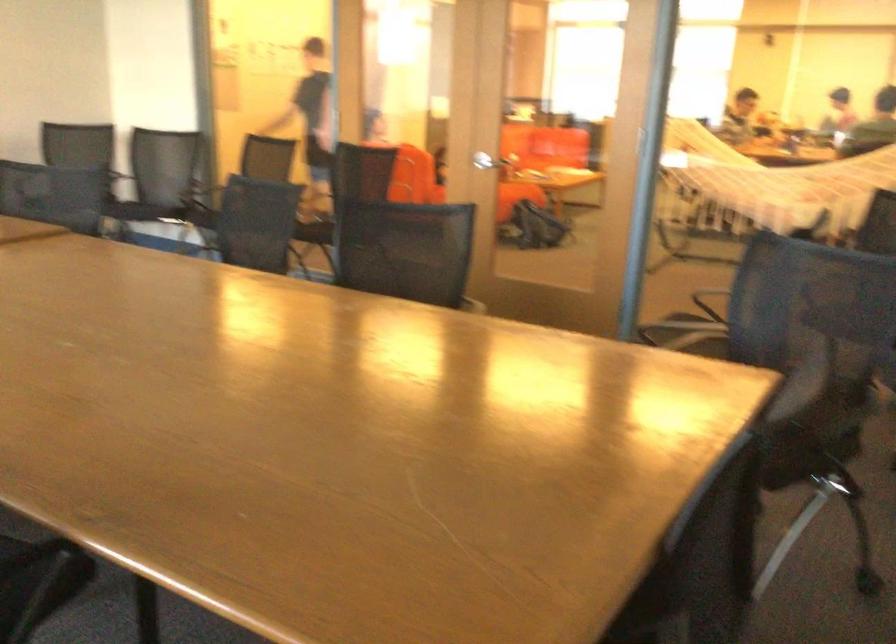
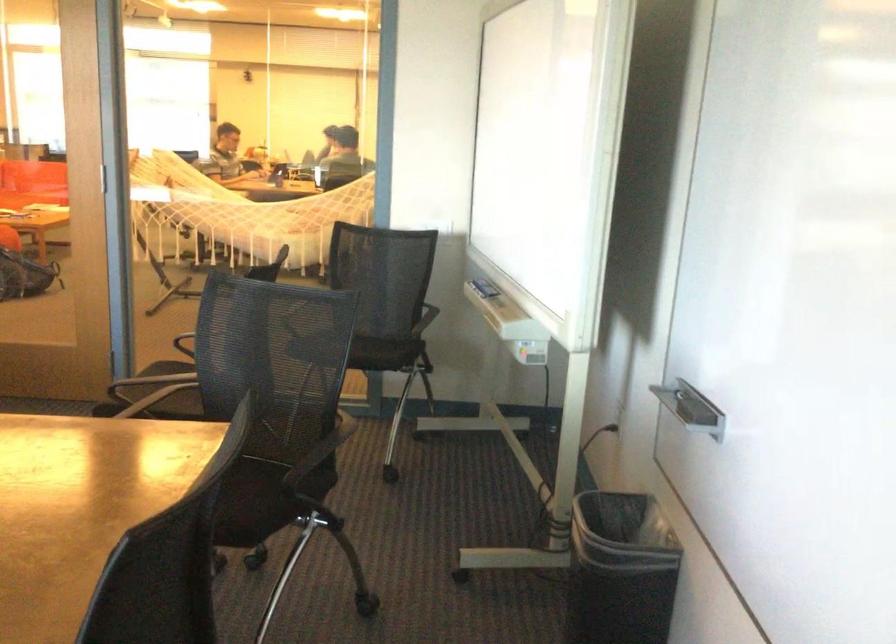
Question: The camera is either moving clockwise (left) or counter-clockwise (right) around the object. The first image is from the beginning of the video and the second image is from the end. Is the camera moving left or right when shooting the video?

Choices:
 (A) Left
 (B) Right

Answer: (A)